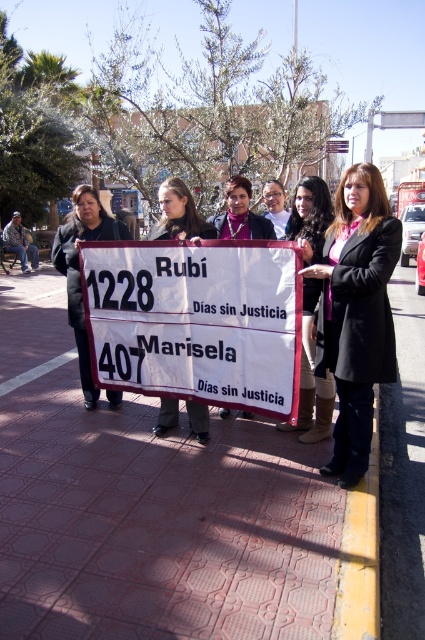
Is matte black coat at center further to camera compared to matte pink scarf at center?

No, matte black coat at center is closer to the viewer.

Is point (322, 397) positioned after point (246, 234)?

No.

Where is `matte black coat at center`? matte black coat at center is located at coordinates (311, 378).

Is black leather coat at center wider than matte pink scarf at center?

Correct, the width of black leather coat at center exceeds that of matte pink scarf at center.

Is point (376, 300) closer to viewer compared to point (244, 209)?

Yes.

This screenshot has height=640, width=425. What are the coordinates of `black leather coat at center` in the screenshot? It's located at tap(356, 312).

Who is positioned more to the right, white paper sign at center or matte black jacket at center?

white paper sign at center

Does white paper sign at center have a greater width compared to matte black jacket at center?

Correct, the width of white paper sign at center exceeds that of matte black jacket at center.

The width and height of the screenshot is (425, 640). I want to click on white paper sign at center, so click(197, 321).